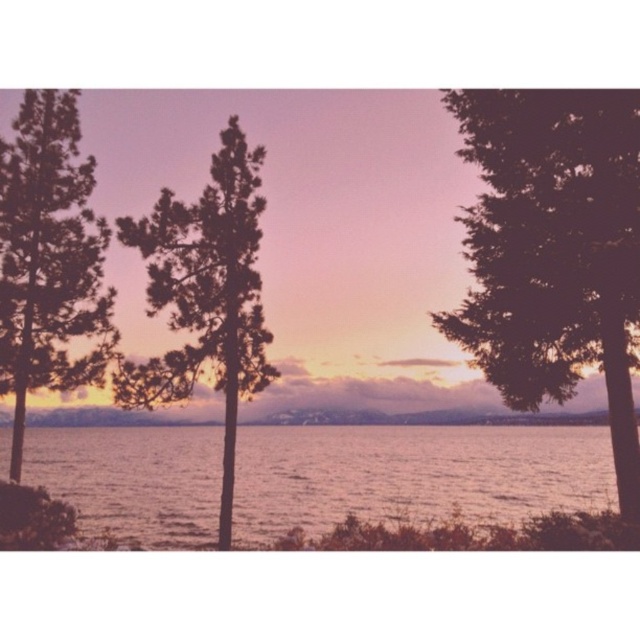
You are standing at the lakeside and want to take a photo of the smooth water at center without the dark green textured tree at right blocking the view. Which direction should you move to ensure the tree is out of frame?

You should move to the left to ensure the dark green textured tree at right is out of frame, as it is positioned to the right of the smooth water at center.

You are a photographer planning to take a photo of the smooth water at center and the green matte tree at center. You want to ensure both elements are in focus. Given that your camera has a depth of field that can cover 14 meters, will both subjects be in focus if you focus on the midpoint between them?

The smooth water at center and green matte tree at center are 14.08 meters apart. Since the camera can cover 14 meters with its depth of field, focusing on the midpoint may not fully capture both in focus due to the slight distance exceeding the coverage. However, in practical terms, the difference of 0.08 meters might be negligible depending on the lens and aperture used.

You are standing at the lakeside and want to take a photo of the green textured tree at left. If your camera has a maximum zoom range of 20 meters, will you be able to capture the entire tree in the photo without moving closer?

The green textured tree at left is 21.49 meters from camera, which exceeds the camera maximum zoom range of 20 meters. Therefore, you won not be able to capture the entire tree in the photo without moving closer.